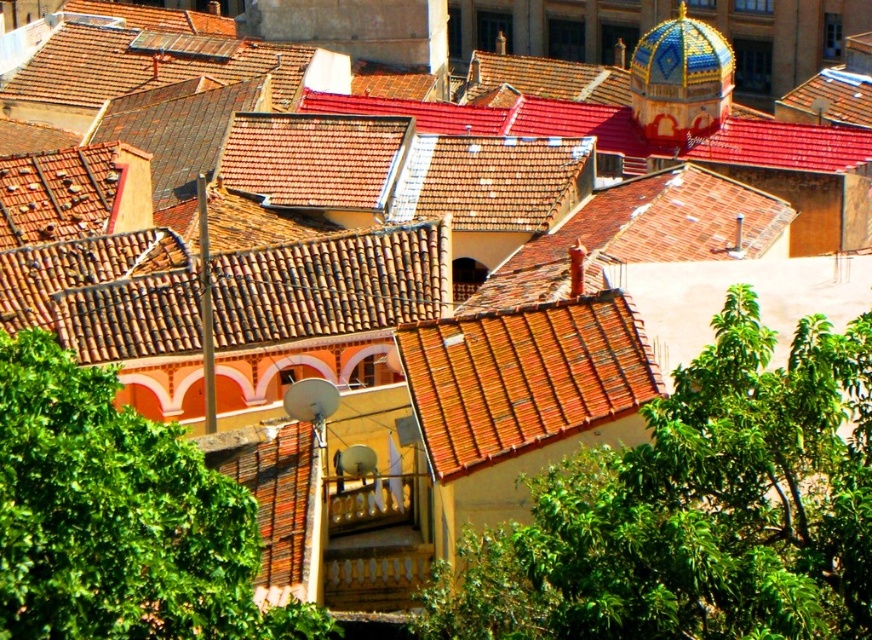
Is green leafy tree at center shorter than green leafy tree at lower left?

No.

Is green leafy tree at center further to camera compared to green leafy tree at lower left?

No, it is in front of green leafy tree at lower left.

The width and height of the screenshot is (872, 640). What do you see at coordinates (693, 509) in the screenshot?
I see `green leafy tree at center` at bounding box center [693, 509].

Where is `green leafy tree at center`? green leafy tree at center is located at coordinates (693, 509).

Who is lower down, green leafy tree at center or blue mosaic dome at upper right?

green leafy tree at center

Which is behind, point (795, 531) or point (641, 93)?

Positioned behind is point (641, 93).

Is point (646, 464) more distant than point (687, 61)?

No, it is not.

Where is `green leafy tree at center`? green leafy tree at center is located at coordinates pyautogui.click(x=693, y=509).

Which is more to the left, brown tile roof at center or blue mosaic dome at upper right?

Positioned to the left is brown tile roof at center.

Is brown tile roof at center wider than blue mosaic dome at upper right?

No, brown tile roof at center is not wider than blue mosaic dome at upper right.

The image size is (872, 640). What are the coordinates of `brown tile roof at center` in the screenshot? It's located at (523, 378).